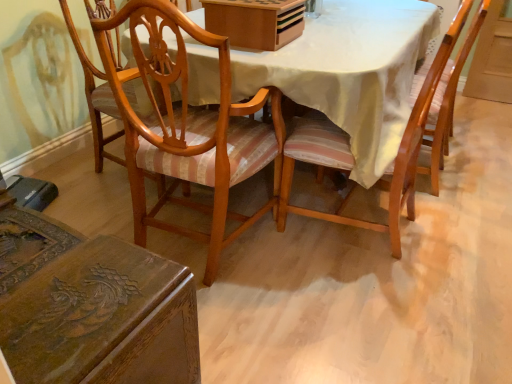
Question: Is wooden chair with striped cushion at center, placed as the second chair when sorted from left to right, placed right next to wooden box at upper center?

Choices:
 (A) no
 (B) yes

Answer: (A)

Question: Does wooden chair with striped cushion at center, placed as the second chair when sorted from left to right, have a greater width compared to wooden box at upper center?

Choices:
 (A) yes
 (B) no

Answer: (A)

Question: Is wooden chair with striped cushion at center, positioned as the 2th chair in right-to-left order, bigger than wooden box at upper center?

Choices:
 (A) no
 (B) yes

Answer: (B)

Question: Is wooden chair with striped cushion at center, positioned as the 2th chair in right-to-left order, smaller than wooden box at upper center?

Choices:
 (A) yes
 (B) no

Answer: (B)

Question: Is wooden chair with striped cushion at center, placed as the second chair when sorted from left to right, not near wooden box at upper center?

Choices:
 (A) no
 (B) yes

Answer: (A)

Question: From the image's perspective, is wooden chair with striped cushion at center, positioned as the 2th chair in right-to-left order, above wooden box at upper center?

Choices:
 (A) no
 (B) yes

Answer: (A)

Question: Is wooden box at upper center to the right of wooden chair with striped cushion at center, the first chair from the right, from the viewer's perspective?

Choices:
 (A) yes
 (B) no

Answer: (B)

Question: Are wooden box at upper center and wooden chair with striped cushion at center, which appears as the third chair when viewed from the left, located far from each other?

Choices:
 (A) no
 (B) yes

Answer: (A)

Question: Considering the relative sizes of wooden box at upper center and wooden chair with striped cushion at center, the first chair from the right, in the image provided, is wooden box at upper center bigger than wooden chair with striped cushion at center, the first chair from the right,?

Choices:
 (A) yes
 (B) no

Answer: (B)

Question: Does wooden box at upper center turn towards wooden chair with striped cushion at center, the first chair from the right?

Choices:
 (A) yes
 (B) no

Answer: (A)

Question: Considering the relative positions of wooden box at upper center and wooden chair with striped cushion at center, the first chair from the right, in the image provided, is wooden box at upper center in front of wooden chair with striped cushion at center, the first chair from the right,?

Choices:
 (A) no
 (B) yes

Answer: (A)

Question: Is wooden box at upper center touching wooden chair with striped cushion at center, the first chair from the right?

Choices:
 (A) no
 (B) yes

Answer: (A)

Question: Is polished wood chair at lower left, which is the 1th chair from left to right, thinner than wooden chair with striped cushion at center, positioned as the 2th chair in right-to-left order?

Choices:
 (A) yes
 (B) no

Answer: (A)